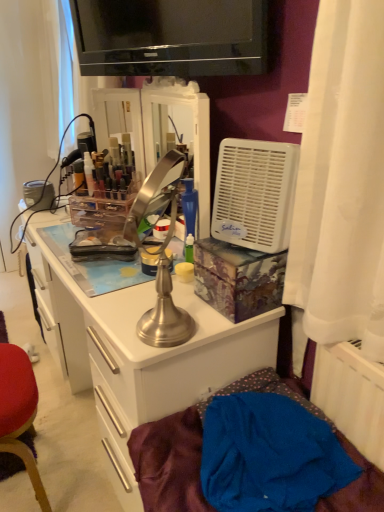
Question: Can you see white plastic air conditioner at right touching black glossy television at upper center?

Choices:
 (A) yes
 (B) no

Answer: (B)

Question: Considering the relative sizes of white plastic air conditioner at right and black glossy television at upper center in the image provided, is white plastic air conditioner at right shorter than black glossy television at upper center?

Choices:
 (A) no
 (B) yes

Answer: (A)

Question: Is white plastic air conditioner at right turned away from black glossy television at upper center?

Choices:
 (A) yes
 (B) no

Answer: (B)

Question: Is white plastic air conditioner at right further to the viewer compared to black glossy television at upper center?

Choices:
 (A) no
 (B) yes

Answer: (A)

Question: Is white plastic air conditioner at right not near black glossy television at upper center?

Choices:
 (A) yes
 (B) no

Answer: (B)

Question: From a real-world perspective, is black glossy television at upper center positioned above or below blue fabric at lower right?

Choices:
 (A) above
 (B) below

Answer: (A)

Question: Looking at their shapes, would you say black glossy television at upper center is wider or thinner than blue fabric at lower right?

Choices:
 (A) thin
 (B) wide

Answer: (A)

Question: From the image's perspective, is black glossy television at upper center above or below blue fabric at lower right?

Choices:
 (A) above
 (B) below

Answer: (A)

Question: Does point (264, 58) appear closer or farther from the camera than point (259, 385)?

Choices:
 (A) closer
 (B) farther

Answer: (A)

Question: Is brushed metal desk at center bigger or smaller than white plastic air conditioner at right?

Choices:
 (A) big
 (B) small

Answer: (A)

Question: Looking at their shapes, would you say brushed metal desk at center is wider or thinner than white plastic air conditioner at right?

Choices:
 (A) thin
 (B) wide

Answer: (B)

Question: Is brushed metal desk at center taller or shorter than white plastic air conditioner at right?

Choices:
 (A) short
 (B) tall

Answer: (B)

Question: From a real-world perspective, is brushed metal desk at center positioned above or below white plastic air conditioner at right?

Choices:
 (A) below
 (B) above

Answer: (A)

Question: From a real-world perspective, is brushed metal desk at center positioned above or below brushed metal table lamp at center?

Choices:
 (A) above
 (B) below

Answer: (B)

Question: Considering their positions, is brushed metal desk at center located in front of or behind brushed metal table lamp at center?

Choices:
 (A) front
 (B) behind

Answer: (B)